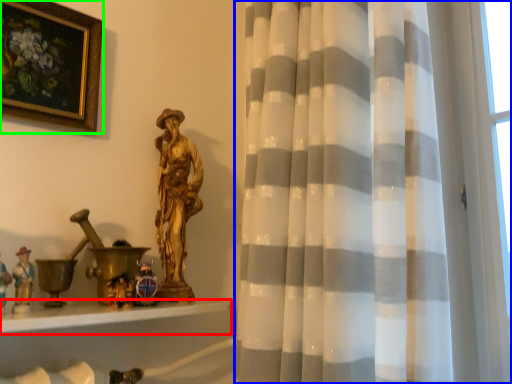
Question: Which object is the closest to the window sill (highlighted by a red box)? Choose among these: curtain (highlighted by a blue box) or picture frame (highlighted by a green box).

Choices:
 (A) curtain
 (B) picture frame

Answer: (A)